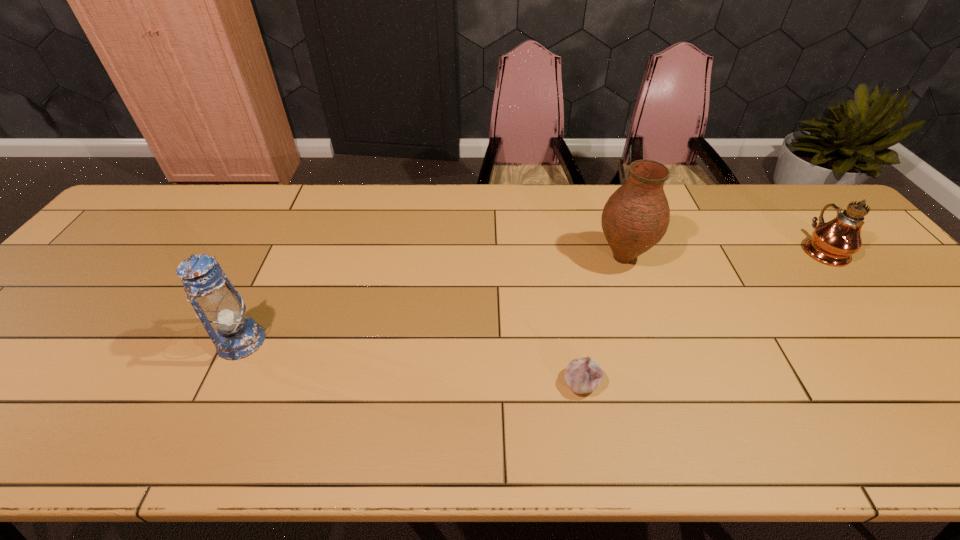
The height and width of the screenshot is (540, 960). I want to click on object located in the right edge section of the desktop, so click(833, 243).

This screenshot has height=540, width=960. I want to click on vacant position at the far edge of the desktop, so click(738, 213).

In the image, there is a desktop. Identify the location of vacant space at the near edge. click(609, 431).

Locate an element on the screen. The width and height of the screenshot is (960, 540). vacant space at the left edge of the desktop is located at coordinates (27, 389).

Find the location of a particular element. This screenshot has height=540, width=960. free location at the right edge of the desktop is located at coordinates (873, 305).

The height and width of the screenshot is (540, 960). Find the location of `free spot between the leftmost object and the vase`. free spot between the leftmost object and the vase is located at coordinates (432, 299).

Find the location of `empty space between the second nearest object and the nearest object`. empty space between the second nearest object and the nearest object is located at coordinates (411, 361).

This screenshot has height=540, width=960. I want to click on vacant space that is in between the lantern and the garlic, so click(x=411, y=361).

The image size is (960, 540). In order to click on vacant region between the garlic and the third farthest object in this screenshot , I will do `click(411, 361)`.

This screenshot has width=960, height=540. What are the coordinates of `vacant space in between the leftmost object and the rightmost object` in the screenshot? It's located at pos(532,295).